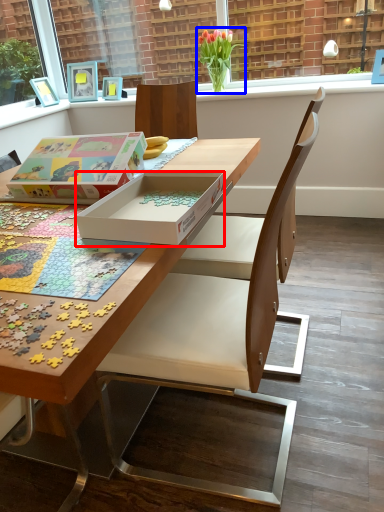
Question: Which of the following is the farthest to the observer, box (highlighted by a red box) or flower (highlighted by a blue box)?

Choices:
 (A) box
 (B) flower

Answer: (B)